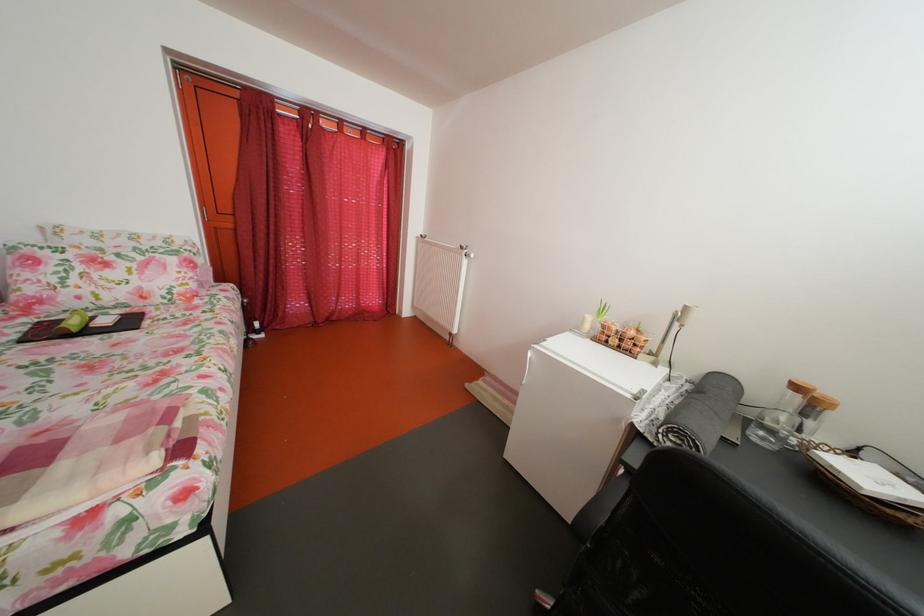
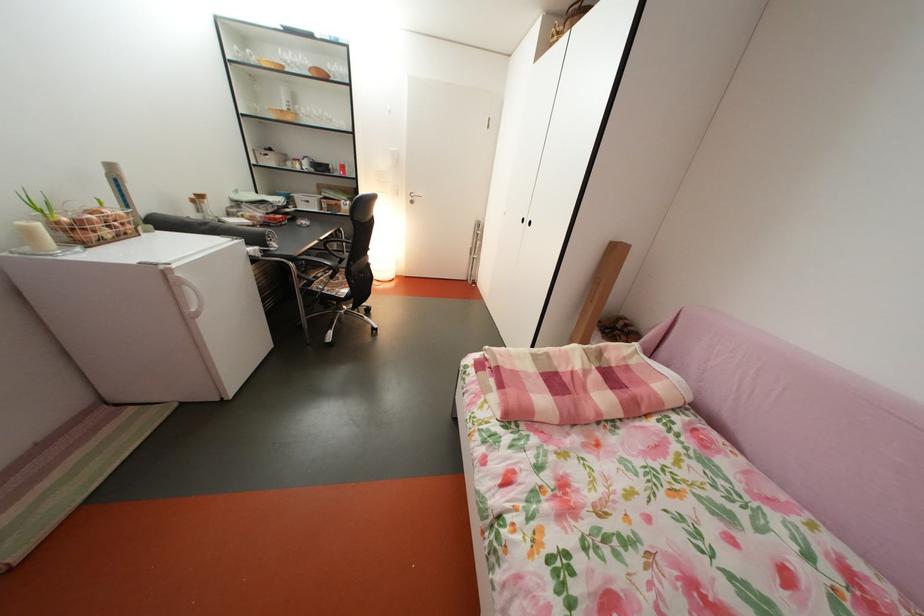
Find the pixel in the second image that matches (x=626, y=347) in the first image.

(118, 238)